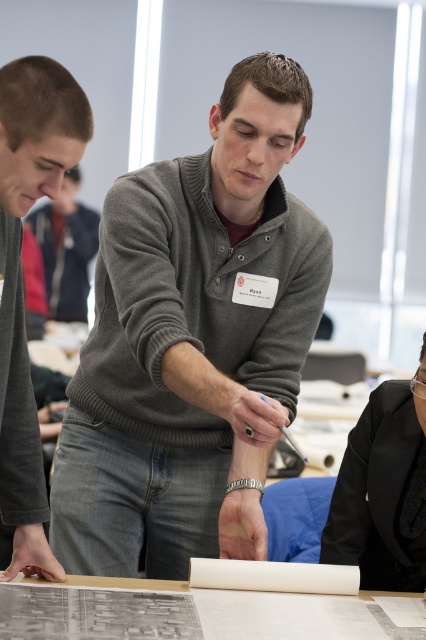
Question: Based on their relative distances, which object is farther from the brown hair at left?

Choices:
 (A) black satin blazer at lower right
 (B) gray sweater at center

Answer: (A)

Question: Which object is closer to the camera taking this photo?

Choices:
 (A) brown hair at left
 (B) black satin blazer at lower right

Answer: (A)

Question: Can you confirm if brown hair at left is smaller than black satin blazer at lower right?

Choices:
 (A) yes
 (B) no

Answer: (B)

Question: Observing the image, what is the correct spatial positioning of gray sweater at center in reference to matte gray sweater at center?

Choices:
 (A) below
 (B) above

Answer: (A)

Question: Which point is closer to the camera?

Choices:
 (A) (97, 406)
 (B) (379, 433)
 (C) (229, 620)

Answer: (C)

Question: Where is brown hair at left located in relation to white paper at center in the image?

Choices:
 (A) below
 (B) above

Answer: (B)